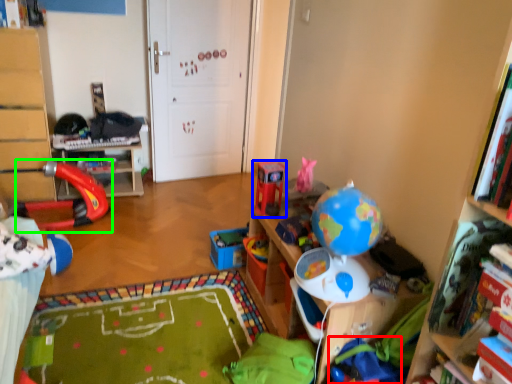
Question: Estimate the real-world distances between objects in this image. Which object is farther from toy (highlighted by a red box), toy (highlighted by a blue box) or toy (highlighted by a green box)?

Choices:
 (A) toy
 (B) toy

Answer: (B)